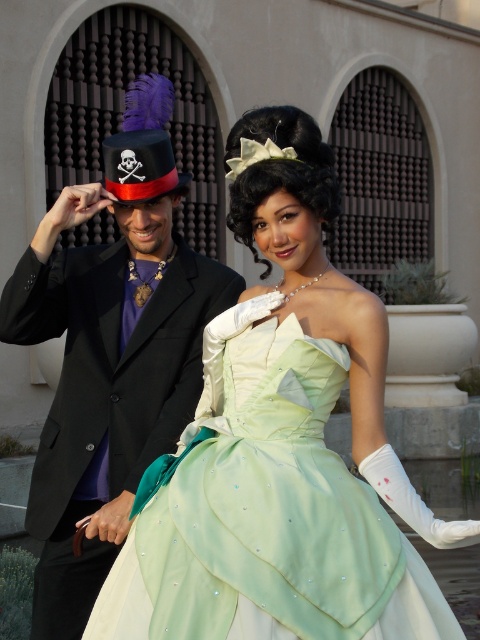
Question: Which point is closer to the camera taking this photo?

Choices:
 (A) (200, 625)
 (B) (128, 164)

Answer: (A)

Question: Is lime satin dress at center below matte black dress hat with skull and crossbones at upper left?

Choices:
 (A) yes
 (B) no

Answer: (A)

Question: Among these points, which one is farthest from the camera?

Choices:
 (A) (45, 452)
 (B) (151, 195)
 (C) (264, 588)

Answer: (A)

Question: Which object appears farthest from the camera in this image?

Choices:
 (A) shiny black top hat at upper left
 (B) matte black dress hat with skull and crossbones at upper left
 (C) lime satin dress at center

Answer: (B)

Question: Is lime satin dress at center to the left of shiny black top hat at upper left from the viewer's perspective?

Choices:
 (A) no
 (B) yes

Answer: (A)

Question: Can you confirm if lime satin dress at center is bigger than matte black dress hat with skull and crossbones at upper left?

Choices:
 (A) yes
 (B) no

Answer: (A)